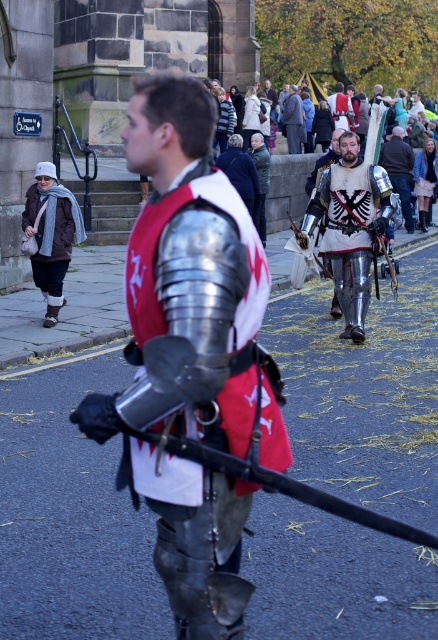
Is polished silver armor at center further to the viewer compared to brown leather jacket at left?

No, polished silver armor at center is closer to the viewer.

Who is more forward, (346,141) or (77,208)?

Point (346,141) is in front.

Where is `polished silver armor at center`? polished silver armor at center is located at coordinates (349, 227).

In the scene shown: Which of these two, brown leather jacket at left or silver metallic armor at center, stands shorter?

With less height is brown leather jacket at left.

Identify the location of brown leather jacket at left. (52, 218).

What are the coordinates of `brown leather jacket at left` in the screenshot? It's located at (52, 218).

You are a GUI agent. You are given a task and a screenshot of the screen. Output one action in this format:
    pyautogui.click(x=<x>, y=<y>)
    Task: Click on the brown leather jacket at left
    This screenshot has height=640, width=438.
    Given the screenshot: What is the action you would take?
    pyautogui.click(x=52, y=218)

Is shiny silver armor at center below polished silver armor at center?

Indeed, shiny silver armor at center is positioned under polished silver armor at center.

Who is more distant from viewer, (x=163, y=577) or (x=346, y=324)?

The point (x=346, y=324) is more distant.

Is point (168, 588) more distant than point (324, 173)?

No.

Find the location of a particular element. shiny silver armor at center is located at coordinates (190, 289).